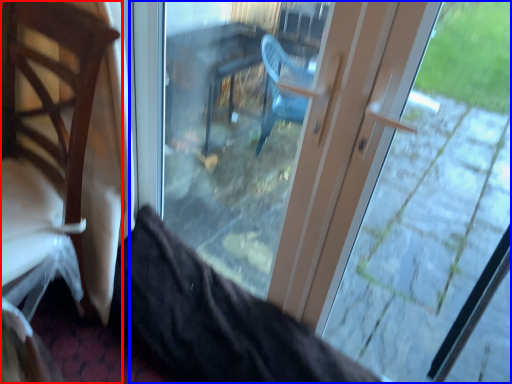
Question: Which object is further to the camera taking this photo, chair (highlighted by a red box) or door (highlighted by a blue box)?

Choices:
 (A) chair
 (B) door

Answer: (A)